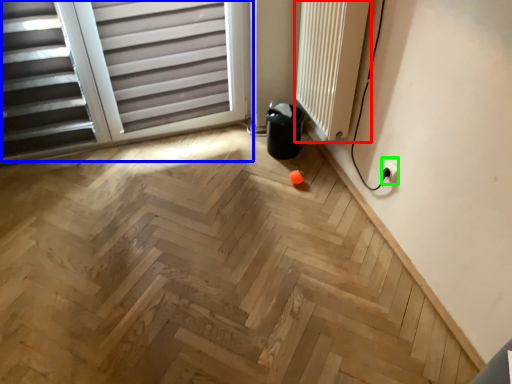
Question: Which object is positioned farthest from radiator (highlighted by a red box)? Select from window (highlighted by a blue box) and electric outlet (highlighted by a green box).

Choices:
 (A) window
 (B) electric outlet

Answer: (A)